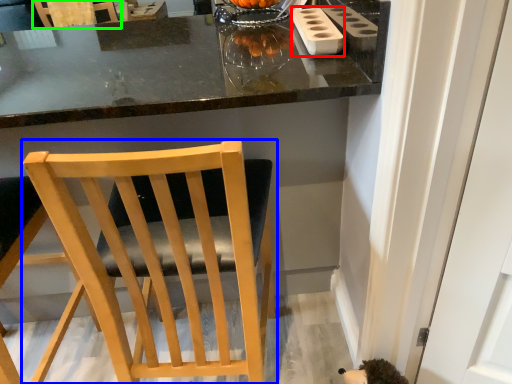
Question: Which object is the farthest from appliance (highlighted by a red box)? Choose among these: chair (highlighted by a blue box) or chair (highlighted by a green box).

Choices:
 (A) chair
 (B) chair

Answer: (B)